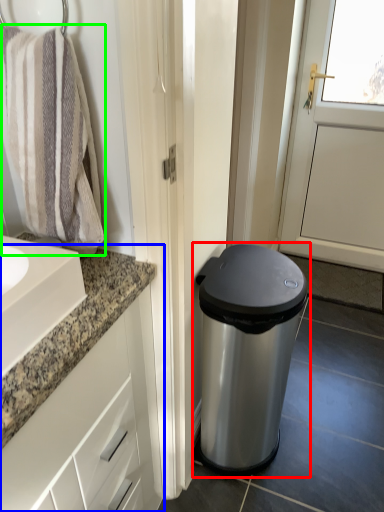
Question: Based on their relative distances, which object is nearer to waste container (highlighted by a red box)? Choose from bathroom cabinet (highlighted by a blue box) and bath towel (highlighted by a green box).

Choices:
 (A) bathroom cabinet
 (B) bath towel

Answer: (A)